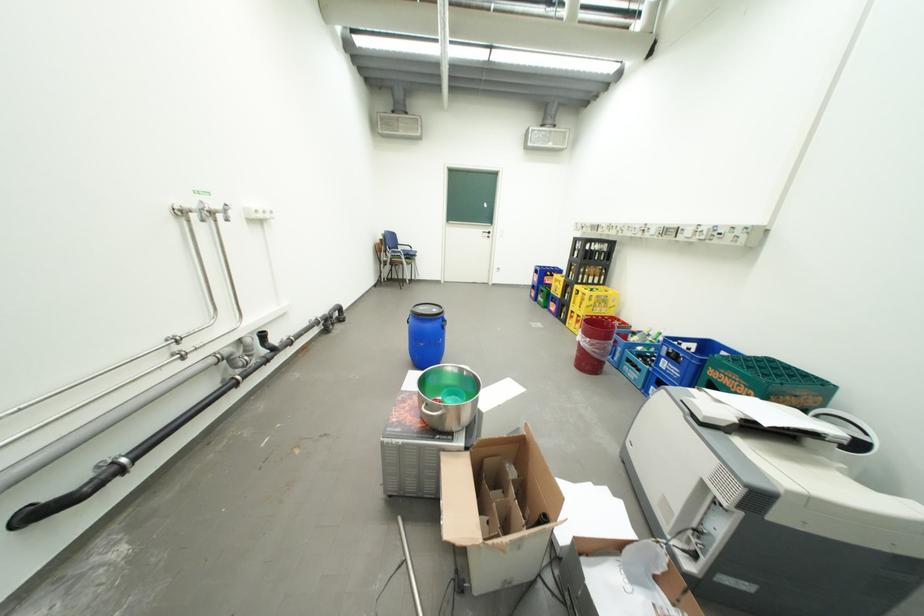
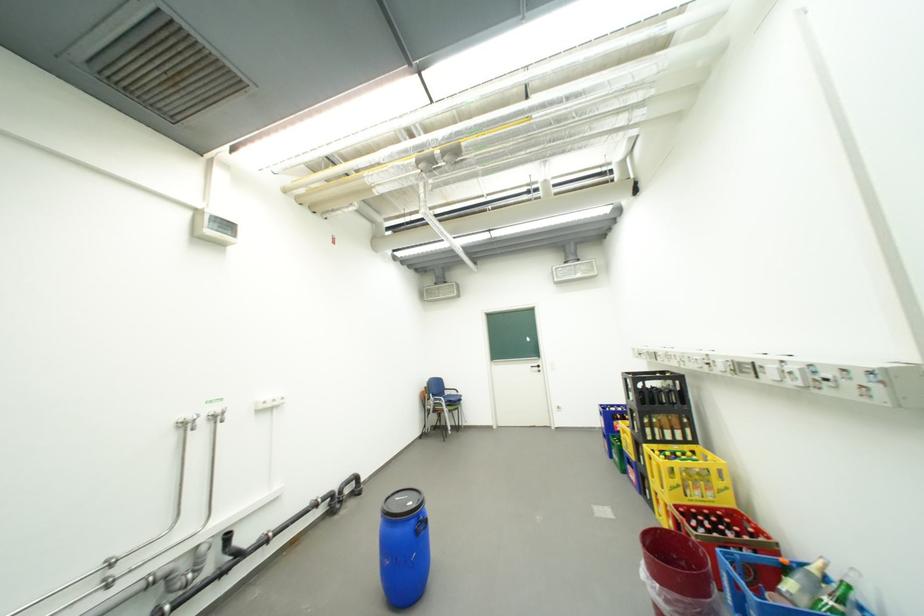
Based on the continuous images, in which direction is the camera rotating?

The rotation direction of the camera is left-up.